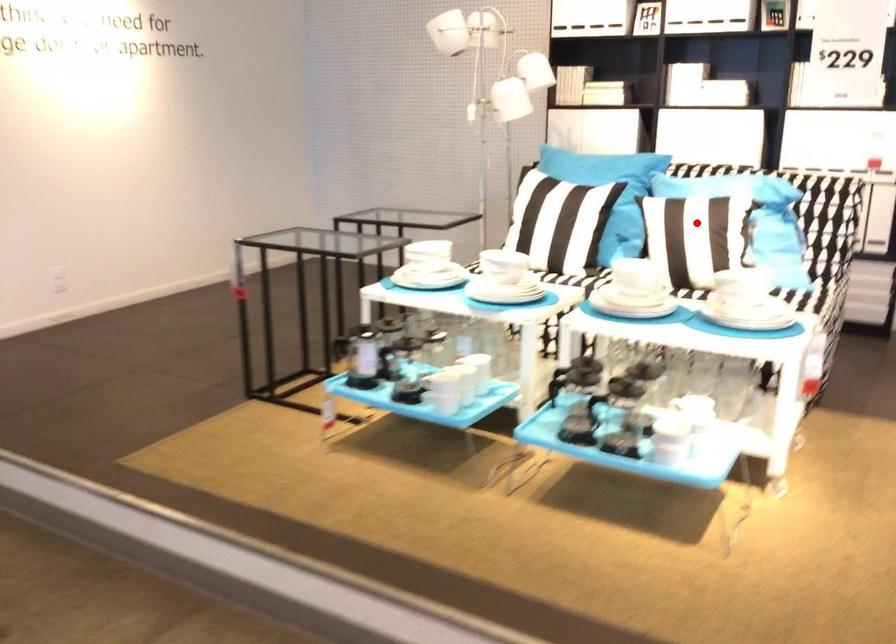
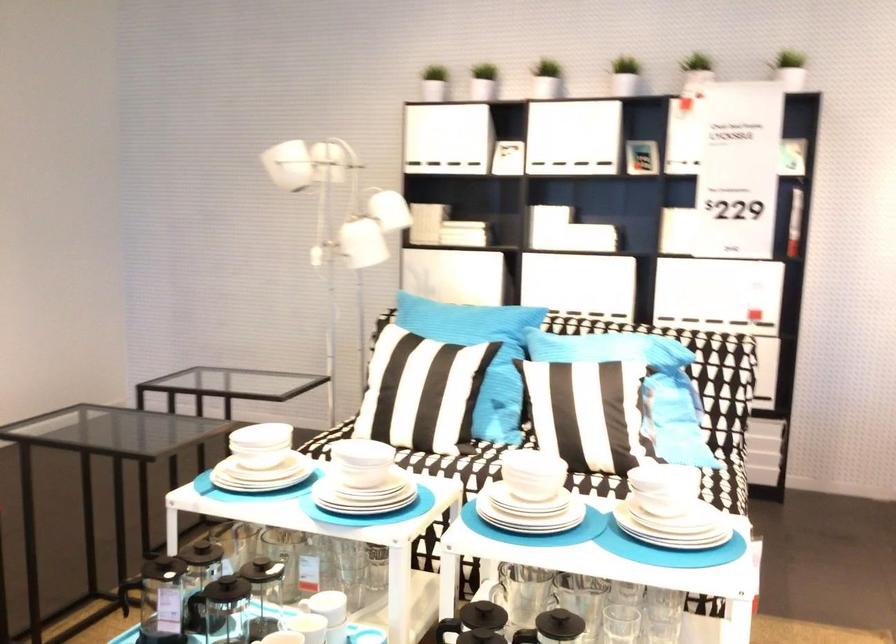
Question: A red point is marked in image1. In image2, is the corresponding 3D point closer to the camera or farther? Reply with the corresponding letter.

Choices:
 (A) The corresponding 3D point is closer.
 (B) The corresponding 3D point is farther.

Answer: (A)